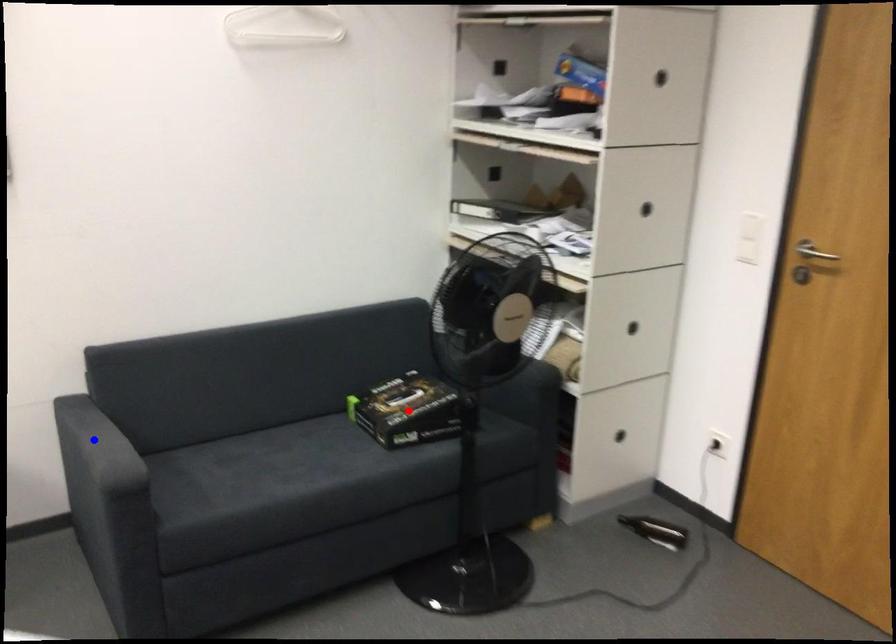
Question: In the image, two points are highlighted. Which point is nearer to the camera? Reply with the corresponding letter.

Choices:
 (A) blue point
 (B) red point

Answer: (A)